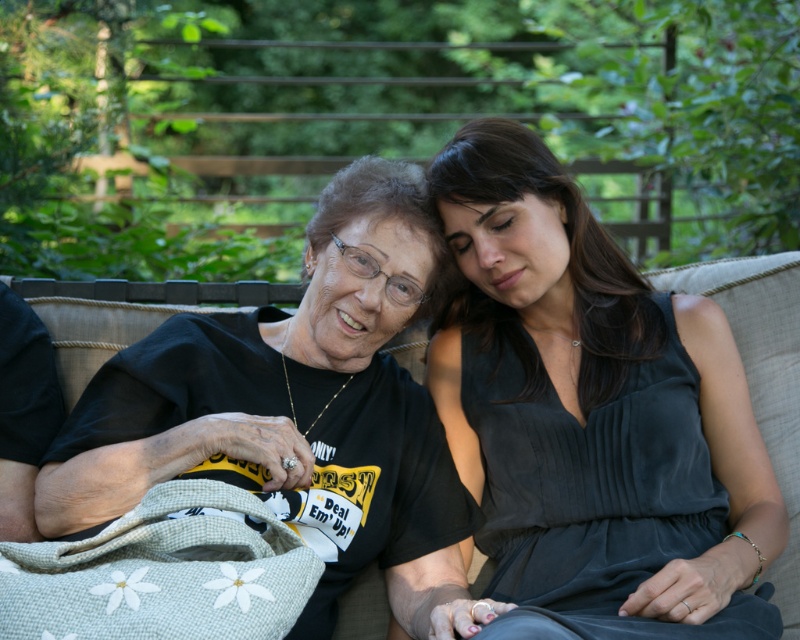
Question: Can you confirm if matte black t-shirt at center is positioned to the right of black matte t-shirt at center?

Choices:
 (A) yes
 (B) no

Answer: (A)

Question: From the image, what is the correct spatial relationship of matte black t-shirt at center in relation to black matte t-shirt at center?

Choices:
 (A) below
 (B) above

Answer: (B)

Question: Is matte black t-shirt at center positioned at the back of black matte t-shirt at center?

Choices:
 (A) yes
 (B) no

Answer: (B)